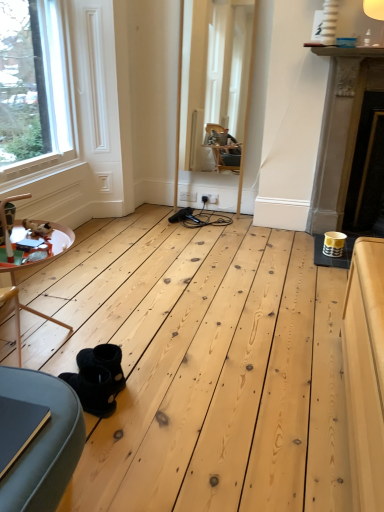
Question: Considering the relative positions of black suede boots at lower left and clear glass window at upper left in the image provided, is black suede boots at lower left in front of clear glass window at upper left?

Choices:
 (A) yes
 (B) no

Answer: (A)

Question: Does black suede boots at lower left have a lesser width compared to clear glass window at upper left?

Choices:
 (A) no
 (B) yes

Answer: (A)

Question: Is clear glass window at upper left at the back of black suede boots at lower left?

Choices:
 (A) yes
 (B) no

Answer: (B)

Question: Does black suede boots at lower left have a larger size compared to clear glass window at upper left?

Choices:
 (A) yes
 (B) no

Answer: (B)

Question: Is black suede boots at lower left to the left of clear glass window at upper left from the viewer's perspective?

Choices:
 (A) yes
 (B) no

Answer: (B)

Question: Is black suede boots at lower left directly adjacent to clear glass window at upper left?

Choices:
 (A) no
 (B) yes

Answer: (A)

Question: Considering the relative sizes of wooden table at lower left and black suede boots at lower left in the image provided, is wooden table at lower left thinner than black suede boots at lower left?

Choices:
 (A) yes
 (B) no

Answer: (B)

Question: Is wooden table at lower left to the right of black suede boots at lower left from the viewer's perspective?

Choices:
 (A) no
 (B) yes

Answer: (A)

Question: Is wooden table at lower left smaller than black suede boots at lower left?

Choices:
 (A) no
 (B) yes

Answer: (A)

Question: Is wooden table at lower left taller than black suede boots at lower left?

Choices:
 (A) no
 (B) yes

Answer: (B)

Question: From a real-world perspective, is wooden table at lower left beneath black suede boots at lower left?

Choices:
 (A) no
 (B) yes

Answer: (A)

Question: Would you say wooden table at lower left contains black suede boots at lower left?

Choices:
 (A) no
 (B) yes

Answer: (A)

Question: Are clear glass window at upper left and gold metallic fireplace at right located far from each other?

Choices:
 (A) no
 (B) yes

Answer: (B)